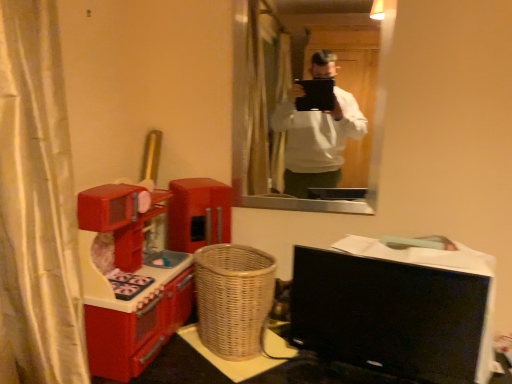
This screenshot has width=512, height=384. Find the location of `woven brown basket at center`. woven brown basket at center is located at coordinates (233, 298).

Describe the element at coordinates (180, 367) in the screenshot. This screenshot has height=384, width=512. I see `woven wood table at lower center` at that location.

Based on the photo, measure the distance between black glossy computer monitor at lower right and camera.

The depth of black glossy computer monitor at lower right is 36.57 inches.

The height and width of the screenshot is (384, 512). Describe the element at coordinates (286, 129) in the screenshot. I see `matte glass mirror at upper center` at that location.

Describe the element at coordinates (127, 281) in the screenshot. The width and height of the screenshot is (512, 384). I see `shiny plastic toy kitchen at left` at that location.

Where is `woven brown basket at center`? woven brown basket at center is located at coordinates (233, 298).

Is black glossy computer monitor at lower right beside matte glass mirror at upper center?

black glossy computer monitor at lower right and matte glass mirror at upper center are clearly separated.

Considering the positions of point (301, 275) and point (259, 189), is point (301, 275) closer or farther from the camera than point (259, 189)?

Point (301, 275) is closer to the camera than point (259, 189).

At what (x,y) coordinates should I click in order to perform the action: click on computer monitor in front of the matte glass mirror at upper center. Please return your answer as a coordinate pair (x, y). Image resolution: width=512 pixels, height=384 pixels. Looking at the image, I should click on (389, 315).

Does black glossy computer monitor at lower right have a greater width compared to matte glass mirror at upper center?

Correct, the width of black glossy computer monitor at lower right exceeds that of matte glass mirror at upper center.

Does woven wood table at lower center appear on the left side of black glossy computer monitor at lower right?

Yes.

From the image's perspective, is woven wood table at lower center over black glossy computer monitor at lower right?

No, from the image's perspective, woven wood table at lower center is not on top of black glossy computer monitor at lower right.

Between point (511, 379) and point (387, 340), which one is positioned in front?

The point (387, 340) is in front.

Considering the relative positions of woven wood table at lower center and shiny plastic toy kitchen at left in the image provided, is woven wood table at lower center in front of shiny plastic toy kitchen at left?

No.

Is shiny plastic toy kitchen at left a part of woven wood table at lower center?

Actually, shiny plastic toy kitchen at left is outside woven wood table at lower center.

Is woven wood table at lower center wider or thinner than shiny plastic toy kitchen at left?

Clearly, woven wood table at lower center has more width compared to shiny plastic toy kitchen at left.

The height and width of the screenshot is (384, 512). In the image, there is a shiny plastic toy kitchen at left. Find the location of `table below it (from a real-world perspective)`. table below it (from a real-world perspective) is located at coordinates (180, 367).

Is shiny plastic toy kitchen at left spatially inside matte glass mirror at upper center, or outside of it?

shiny plastic toy kitchen at left is not inside matte glass mirror at upper center, it's outside.

Could you tell me if shiny plastic toy kitchen at left is turned towards matte glass mirror at upper center?

No, shiny plastic toy kitchen at left does not turn towards matte glass mirror at upper center.

Between point (88, 263) and point (244, 32), which one is positioned behind?

The point (244, 32) is farther.

Which of these two, shiny plastic toy kitchen at left or matte glass mirror at upper center, is bigger?

With larger size is shiny plastic toy kitchen at left.

Is point (421, 294) positioned behind point (273, 281)?

No, it is in front of (273, 281).

Is black glossy computer monitor at lower right placed right next to woven brown basket at center?

No, black glossy computer monitor at lower right is not with woven brown basket at center.

Choose the correct answer: Is black glossy computer monitor at lower right inside woven brown basket at center or outside it?

black glossy computer monitor at lower right is not inside woven brown basket at center, it's outside.

Looking at this image, can you tell me how much black glossy computer monitor at lower right and woven brown basket at center differ in facing direction?

There is a 12.9-degree angle between the facing directions of black glossy computer monitor at lower right and woven brown basket at center.

Is matte glass mirror at upper center with woven brown basket at center?

matte glass mirror at upper center and woven brown basket at center are not in contact.

In order to click on mirror located above the woven brown basket at center (from a real-world perspective) in this screenshot , I will do `click(286, 129)`.

From the image's perspective, is matte glass mirror at upper center beneath woven brown basket at center?

Actually, matte glass mirror at upper center appears above woven brown basket at center in the image.

How much distance is there between black glossy computer monitor at lower right and shiny plastic toy kitchen at left?

A distance of 18.57 inches exists between black glossy computer monitor at lower right and shiny plastic toy kitchen at left.

Considering the sizes of objects black glossy computer monitor at lower right and shiny plastic toy kitchen at left in the image provided, who is wider, black glossy computer monitor at lower right or shiny plastic toy kitchen at left?

shiny plastic toy kitchen at left.

Who is shorter, black glossy computer monitor at lower right or shiny plastic toy kitchen at left?

black glossy computer monitor at lower right.

At what (x,y) coordinates should I click in order to perform the action: click on computer monitor in front of the matte glass mirror at upper center. Please return your answer as a coordinate pair (x, y). Image resolution: width=512 pixels, height=384 pixels. Looking at the image, I should click on (389, 315).

The width and height of the screenshot is (512, 384). Find the location of `table below the black glossy computer monitor at lower right (from the image's perspective)`. table below the black glossy computer monitor at lower right (from the image's perspective) is located at coordinates (180, 367).

When comparing their distances from black glossy computer monitor at lower right, does matte glass mirror at upper center or woven wood table at lower center seem further?

The object further to black glossy computer monitor at lower right is matte glass mirror at upper center.

Considering their positions, is woven brown basket at center positioned closer to black glossy computer monitor at lower right than woven wood table at lower center?

woven wood table at lower center lies closer to black glossy computer monitor at lower right than the other object.

Considering their positions, is black glossy computer monitor at lower right positioned closer to shiny plastic toy kitchen at left than woven brown basket at center?

Based on the image, woven brown basket at center appears to be nearer to shiny plastic toy kitchen at left.

From the image, which object appears to be farther from woven brown basket at center, shiny plastic toy kitchen at left or black glossy computer monitor at lower right?

black glossy computer monitor at lower right lies further to woven brown basket at center than the other object.

When comparing their distances from matte glass mirror at upper center, does woven wood table at lower center or shiny plastic toy kitchen at left seem closer?

The object closer to matte glass mirror at upper center is shiny plastic toy kitchen at left.

Which object lies further to the anchor point woven wood table at lower center, black glossy computer monitor at lower right or shiny plastic toy kitchen at left?

shiny plastic toy kitchen at left is positioned further to the anchor woven wood table at lower center.

From the picture: Which object lies nearer to the anchor point matte glass mirror at upper center, woven wood table at lower center or woven brown basket at center?

woven brown basket at center lies closer to matte glass mirror at upper center than the other object.

Looking at the image, which one is located closer to shiny plastic toy kitchen at left, matte glass mirror at upper center or woven brown basket at center?

Among the two, woven brown basket at center is located nearer to shiny plastic toy kitchen at left.

Identify the location of basket between matte glass mirror at upper center and woven wood table at lower center in the vertical direction. coord(233,298).

Find the location of a particular element. computer monitor that lies between matte glass mirror at upper center and woven wood table at lower center from top to bottom is located at coordinates (389, 315).

Identify the location of mirror located between shiny plastic toy kitchen at left and black glossy computer monitor at lower right in the left-right direction. This screenshot has height=384, width=512. (286, 129).

At what (x,y) coordinates should I click in order to perform the action: click on furniture between matte glass mirror at upper center and woven brown basket at center in the vertical direction. Please return your answer as a coordinate pair (x, y). This screenshot has width=512, height=384. Looking at the image, I should click on (127, 281).